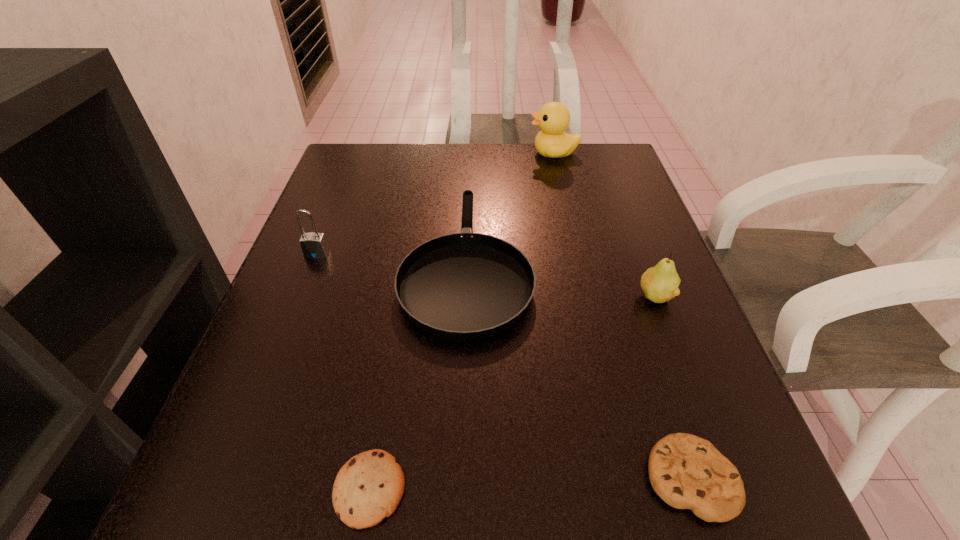
Locate an element on the screen. The height and width of the screenshot is (540, 960). vacant space at the far right corner is located at coordinates (573, 171).

You are a GUI agent. You are given a task and a screenshot of the screen. Output one action in this format:
    pyautogui.click(x=<x>, y=<y>)
    Task: Click on the vacant space that's between the frying pan and the shortest object
    
    Given the screenshot: What is the action you would take?
    pyautogui.click(x=419, y=376)

Find the location of a particular element. The image size is (960, 540). empty location between the pear and the right cookie is located at coordinates (673, 388).

Identify the location of vacant point located between the leftmost object and the duck. The width and height of the screenshot is (960, 540). (435, 204).

I want to click on free space between the shorter cookie and the leftmost object, so click(344, 372).

Locate an element on the screen. free area in between the pear and the farthest object is located at coordinates (604, 225).

Locate an element on the screen. The image size is (960, 540). vacant point located between the second shortest object and the shortest object is located at coordinates (530, 484).

At what (x,y) coordinates should I click in order to perform the action: click on the second closest object relative to the pear. Please return your answer as a coordinate pair (x, y). The height and width of the screenshot is (540, 960). Looking at the image, I should click on (686, 471).

The image size is (960, 540). In order to click on object that is the closest one to the pear in this screenshot , I will do `click(463, 286)`.

I want to click on vacant region that satisfies the following two spatial constraints: 1. on the face of the farthest object; 2. on the back side of the taller cookie, so click(x=629, y=478).